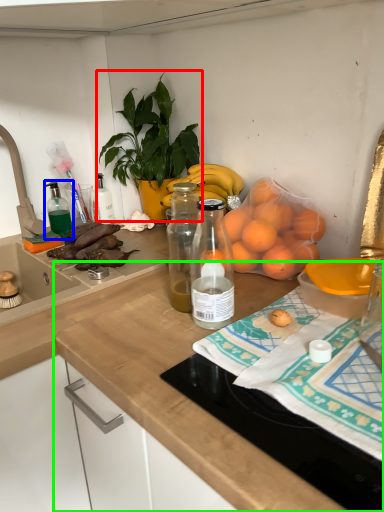
Question: Based on their relative distances, which object is nearer to houseplant (highlighted by a red box)? Choose from bottle (highlighted by a blue box) and countertop (highlighted by a green box).

Choices:
 (A) bottle
 (B) countertop

Answer: (A)